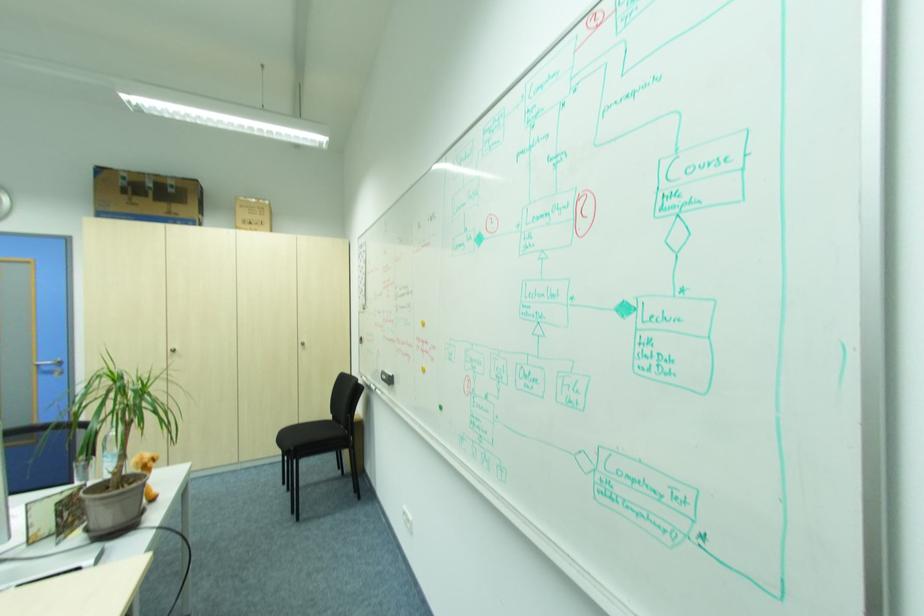
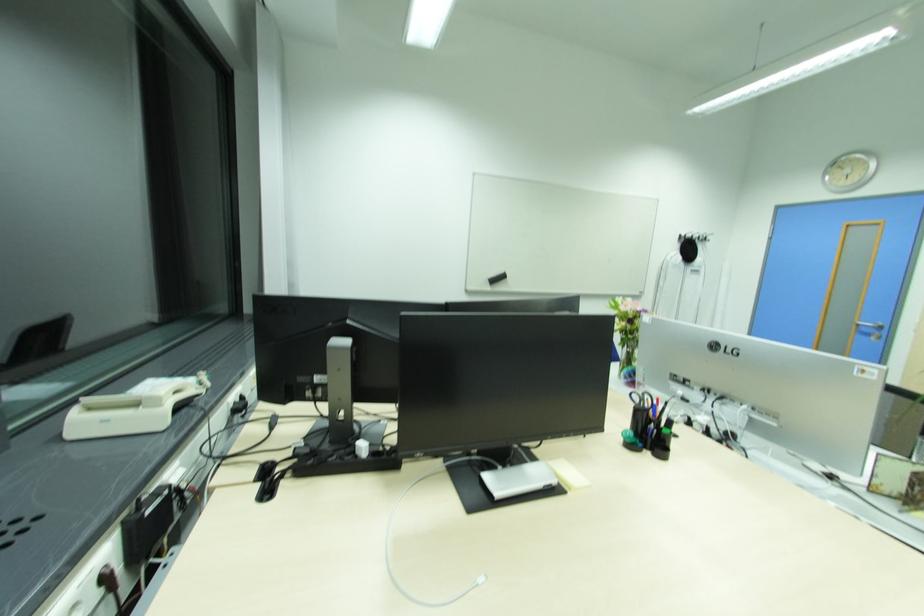
Find the pixel in the second image that matches (34,264) in the first image.

(882, 224)